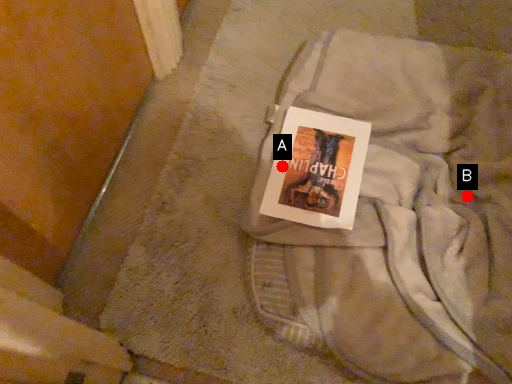
Question: Two points are circled on the image, labeled by A and B beside each circle. Which point is closer to the camera?

Choices:
 (A) A is closer
 (B) B is closer

Answer: (A)